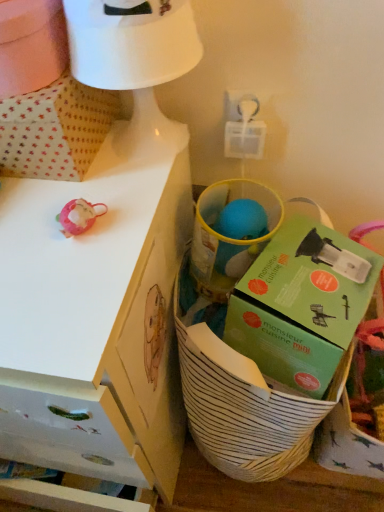
This screenshot has height=512, width=384. What are the coordinates of `free space in front of white dotted fabric at upper left` in the screenshot? It's located at (65, 232).